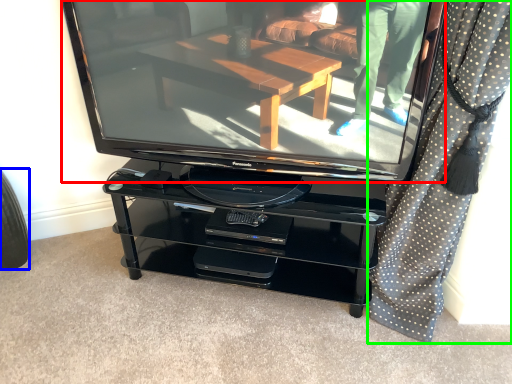
Question: Estimate the real-world distances between objects in this image. Which object is farther from television (highlighted by a red box), tire (highlighted by a blue box) or curtain (highlighted by a green box)?

Choices:
 (A) tire
 (B) curtain

Answer: (A)